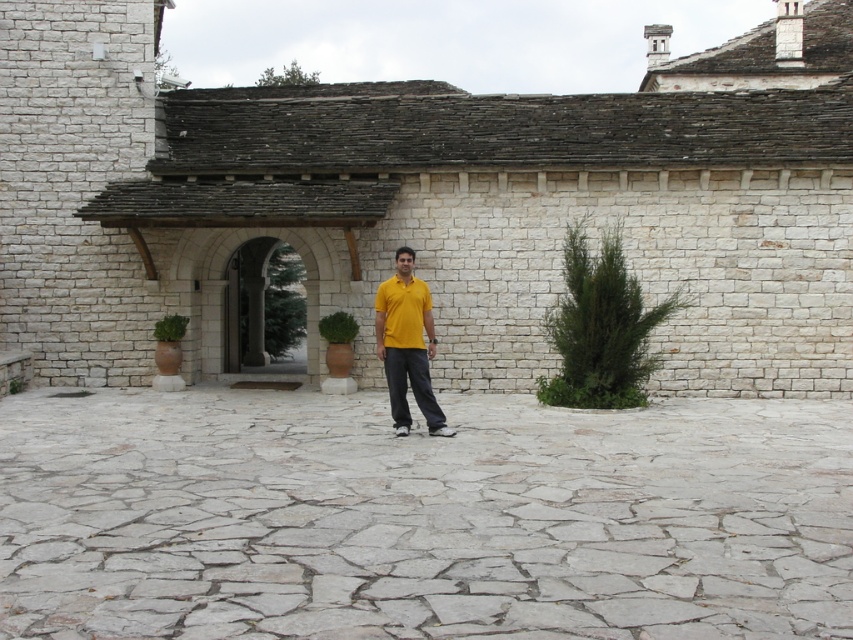
Question: Observing the image, what is the correct spatial positioning of gray stone courtyard at center in reference to yellow matte shirt at center?

Choices:
 (A) right
 (B) left

Answer: (A)

Question: Which point is farther from the camera taking this photo?

Choices:
 (A) (757, 598)
 (B) (407, 304)

Answer: (B)

Question: Which point appears farthest from the camera in this image?

Choices:
 (A) (407, 424)
 (B) (274, 528)

Answer: (A)

Question: Which point is farther to the camera?

Choices:
 (A) yellow matte shirt at center
 (B) gray stone courtyard at center

Answer: (A)

Question: Does gray stone courtyard at center appear over yellow matte shirt at center?

Choices:
 (A) no
 (B) yes

Answer: (A)

Question: Can you confirm if gray stone courtyard at center is positioned below yellow matte shirt at center?

Choices:
 (A) no
 (B) yes

Answer: (B)